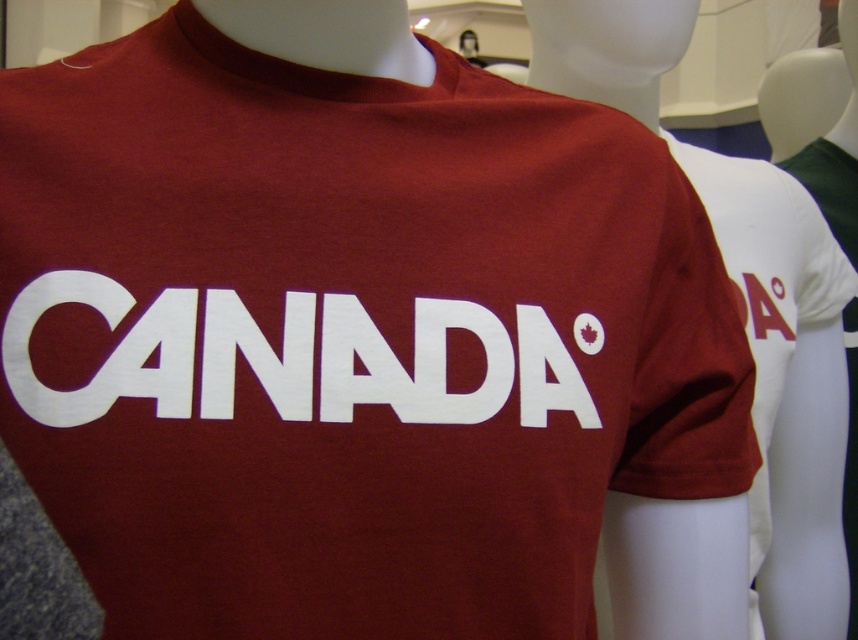
Measure the distance between point (602, 84) and camera.

Point (602, 84) and camera are 87.93 centimeters apart from each other.

Who is higher up, maroon t-shirt at center or matte red maple leaf at center?

maroon t-shirt at center

At what (x,y) coordinates should I click in order to perform the action: click on maroon t-shirt at center. Please return your answer as a coordinate pair (x, y). The height and width of the screenshot is (640, 858). Looking at the image, I should click on (742, 298).

Which of these two, maroon t-shirt at center or white matte text at center, stands shorter?

white matte text at center is shorter.

Can you confirm if maroon t-shirt at center is positioned above white matte text at center?

Yes.

Which is behind, point (576, 92) or point (313, 330)?

Positioned behind is point (576, 92).

Locate an element on the screen. This screenshot has width=858, height=640. maroon t-shirt at center is located at coordinates (742, 298).

Is point (554, 369) less distant than point (576, 332)?

Yes, point (554, 369) is closer to viewer.

Which is in front, point (454, 420) or point (576, 332)?

Positioned in front is point (454, 420).

Does point (351, 310) lie in front of point (577, 317)?

Yes, it is in front of point (577, 317).

The width and height of the screenshot is (858, 640). What are the coordinates of `white matte text at center` in the screenshot? It's located at (446, 365).